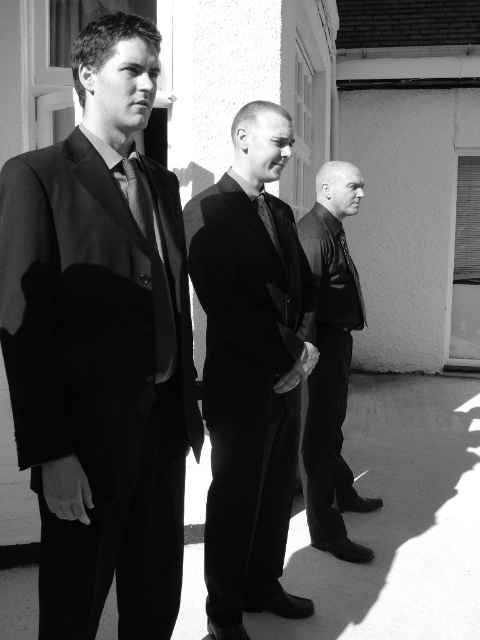
Is matte black suit at center bigger than smooth black jacket at center?

No, matte black suit at center is not bigger than smooth black jacket at center.

Is point (287, 464) less distant than point (312, 273)?

That is True.

Locate an element on the screen. The image size is (480, 640). matte black suit at center is located at coordinates (250, 371).

From the picture: How far apart are matte black suit at left and matte black tie at left?

matte black suit at left and matte black tie at left are 8.88 inches apart from each other.

Is point (143, 529) closer to viewer compared to point (166, 372)?

No, it is not.

Is point (36, 212) behind point (175, 340)?

No, (36, 212) is closer to viewer.

At what (x,y) coordinates should I click in order to perform the action: click on matte black suit at left. Please return your answer as a coordinate pair (x, y). This screenshot has height=640, width=480. Looking at the image, I should click on (101, 346).

What do you see at coordinates (101, 346) in the screenshot? The height and width of the screenshot is (640, 480). I see `matte black suit at left` at bounding box center [101, 346].

Is matte black suit at left in front of matte black suit at center?

Yes.

Find the location of a particular element. matte black suit at left is located at coordinates (101, 346).